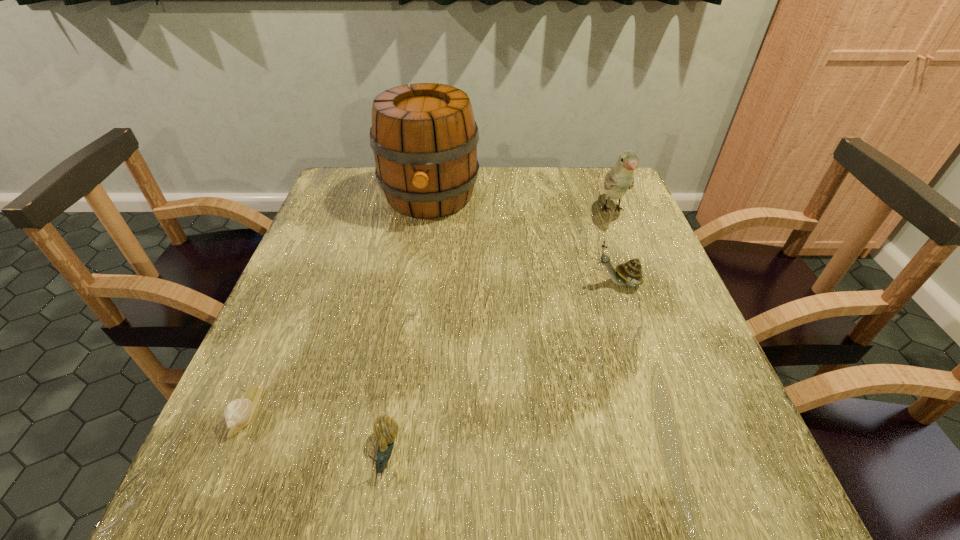
Identify the location of snail at the right edge. This screenshot has height=540, width=960. (630, 273).

You are a GUI agent. You are given a task and a screenshot of the screen. Output one action in this format:
    pyautogui.click(x=<x>, y=<y>)
    Task: Click on the object situated at the far left corner
    Image resolution: width=960 pixels, height=540 pixels.
    Given the screenshot: What is the action you would take?
    424,138

In order to click on object present at the far right corner in this screenshot , I will do `click(620, 178)`.

The width and height of the screenshot is (960, 540). In the image, there is a desktop. Find the location of `vacant space at the far edge`. vacant space at the far edge is located at coordinates (545, 184).

Find the location of a particular element. The width and height of the screenshot is (960, 540). free point at the near edge is located at coordinates (519, 499).

The width and height of the screenshot is (960, 540). Identify the location of free space at the left edge of the desktop. (222, 421).

The width and height of the screenshot is (960, 540). What are the coordinates of `vacant space at the far right corner of the desktop` in the screenshot? It's located at (629, 205).

Where is `free location at the near right corner of the desktop`? free location at the near right corner of the desktop is located at coordinates (722, 491).

This screenshot has width=960, height=540. What are the coordinates of `free space between the leftmost escargot and the tallest object` in the screenshot? It's located at (339, 303).

Find the location of `free space between the rightmost escargot and the leftmost object`. free space between the rightmost escargot and the leftmost object is located at coordinates (433, 347).